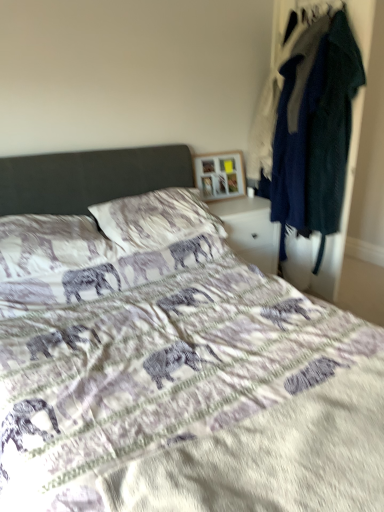
Question: From a real-world perspective, is textured cotton pillow at center, arranged as the 2th pillow when viewed from the right, physically below wooden picture frame at upper center?

Choices:
 (A) no
 (B) yes

Answer: (B)

Question: Considering the relative positions of textured cotton pillow at center, arranged as the 2th pillow when viewed from the right, and wooden picture frame at upper center in the image provided, is textured cotton pillow at center, arranged as the 2th pillow when viewed from the right, in front of wooden picture frame at upper center?

Choices:
 (A) no
 (B) yes

Answer: (B)

Question: Is textured cotton pillow at center, arranged as the 2th pillow when viewed from the right, positioned with its back to wooden picture frame at upper center?

Choices:
 (A) no
 (B) yes

Answer: (A)

Question: Does textured cotton pillow at center, arranged as the 2th pillow when viewed from the right, appear on the left side of wooden picture frame at upper center?

Choices:
 (A) no
 (B) yes

Answer: (B)

Question: From the image's perspective, is textured cotton pillow at center, arranged as the 2th pillow when viewed from the right, located beneath wooden picture frame at upper center?

Choices:
 (A) no
 (B) yes

Answer: (B)

Question: Considering the positions of point click(x=150, y=301) and point click(x=342, y=180), is point click(x=150, y=301) closer or farther from the camera than point click(x=342, y=180)?

Choices:
 (A) closer
 (B) farther

Answer: (A)

Question: From their relative heights in the image, would you say printed fabric bed at center is taller or shorter than dark blue fabric coat at right?

Choices:
 (A) tall
 (B) short

Answer: (B)

Question: From the image's perspective, relative to dark blue fabric coat at right, is printed fabric bed at center above or below?

Choices:
 (A) above
 (B) below

Answer: (B)

Question: Is printed fabric bed at center spatially inside dark blue fabric coat at right, or outside of it?

Choices:
 (A) outside
 (B) inside

Answer: (A)

Question: Visually, is dark blue fabric coat at right positioned to the left or to the right of wooden picture frame at upper center?

Choices:
 (A) left
 (B) right

Answer: (B)

Question: Would you say dark blue fabric coat at right is inside or outside wooden picture frame at upper center?

Choices:
 (A) inside
 (B) outside

Answer: (B)

Question: Does point (276, 91) appear closer or farther from the camera than point (196, 155)?

Choices:
 (A) closer
 (B) farther

Answer: (A)

Question: From a real-world perspective, is dark blue fabric coat at right positioned above or below wooden picture frame at upper center?

Choices:
 (A) below
 (B) above

Answer: (B)

Question: Would you say textured cotton pillow at center, arranged as the 2th pillow when viewed from the right, is inside or outside printed fabric bed at center?

Choices:
 (A) outside
 (B) inside

Answer: (B)

Question: From the image's perspective, is textured cotton pillow at center, arranged as the 2th pillow when viewed from the right, positioned above or below printed fabric bed at center?

Choices:
 (A) below
 (B) above

Answer: (B)